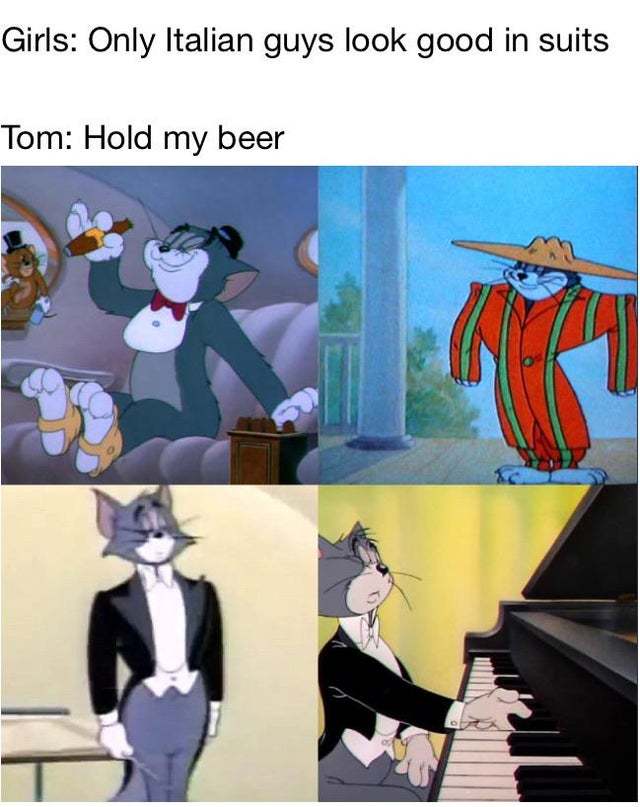
Image resolution: width=640 pixels, height=807 pixels. What are the coordinates of `mouse` in the screenshot? It's located at pos(26,282).